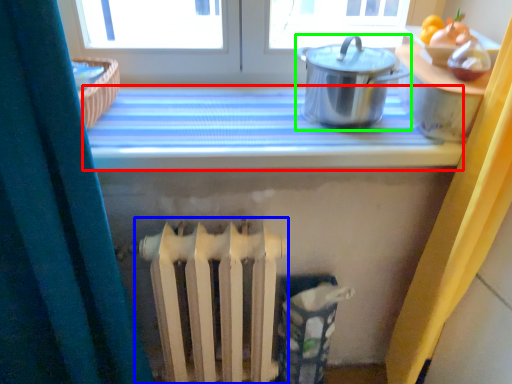
Question: Which is nearer to the counter top (highlighted by a red box)? radiator (highlighted by a blue box) or kitchen appliance (highlighted by a green box).

Choices:
 (A) radiator
 (B) kitchen appliance

Answer: (B)